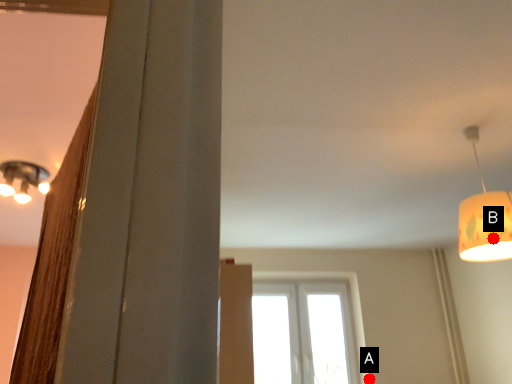
Question: Two points are circled on the image, labeled by A and B beside each circle. Which point appears closest to the camera in this image?

Choices:
 (A) A is closer
 (B) B is closer

Answer: (B)